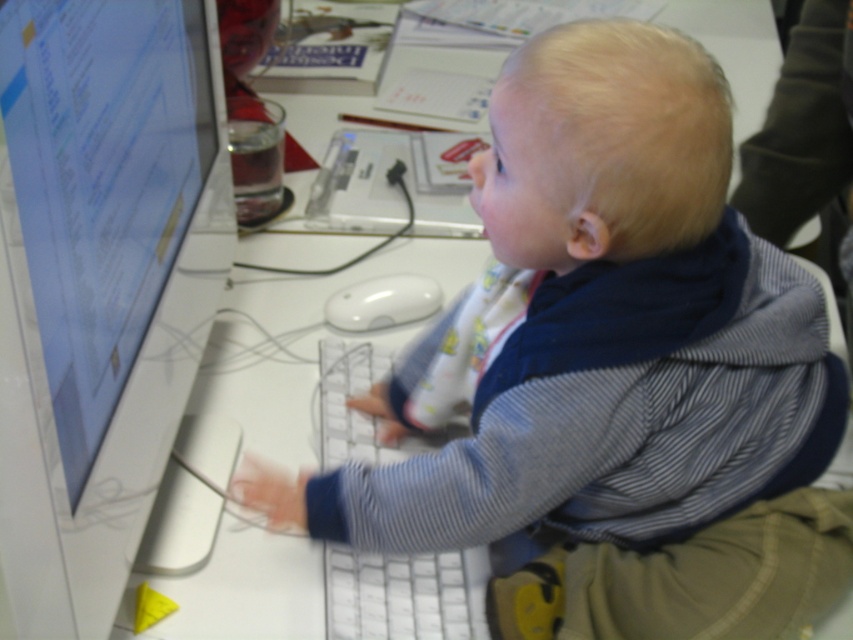
Can you confirm if striped cotton shirt at center is bigger than white plastic keyboard at center?

Yes.

Between striped cotton shirt at center and white plastic keyboard at center, which one has less height?

white plastic keyboard at center

Does point (488, 413) come in front of point (439, 630)?

Yes, point (488, 413) is closer to viewer.

You are a GUI agent. You are given a task and a screenshot of the screen. Output one action in this format:
    pyautogui.click(x=<x>, y=<y>)
    Task: Click on the striped cotton shirt at center
    This screenshot has height=640, width=853.
    Given the screenshot: What is the action you would take?
    pyautogui.click(x=625, y=368)

Does white plastic keyboard at center have a lesser width compared to white matte mouse at center?

Incorrect, white plastic keyboard at center's width is not less than white matte mouse at center's.

Can you confirm if white plastic keyboard at center is bigger than white matte mouse at center?

Correct, white plastic keyboard at center is larger in size than white matte mouse at center.

Describe the element at coordinates (404, 595) in the screenshot. I see `white plastic keyboard at center` at that location.

Find the location of a particular element. white plastic keyboard at center is located at coordinates (404, 595).

Between white glossy monitor at left and white plastic keyboard at center, which one has less height?

With less height is white plastic keyboard at center.

Is white glossy monitor at left closer to the viewer compared to white plastic keyboard at center?

That is True.

This screenshot has width=853, height=640. I want to click on white glossy monitor at left, so [100, 284].